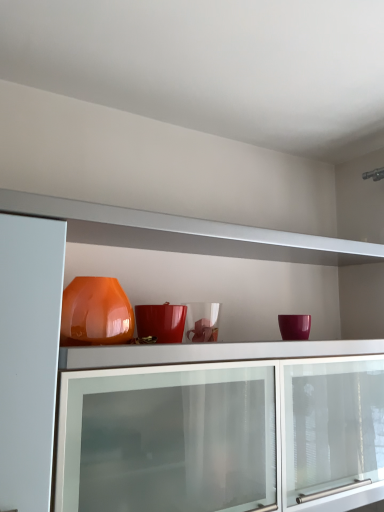
I want to click on matte orange vase at upper center, so click(225, 248).

What do you see at coordinates (225, 248) in the screenshot?
I see `matte orange vase at upper center` at bounding box center [225, 248].

You are a GUI agent. You are given a task and a screenshot of the screen. Output one action in this format:
    pyautogui.click(x=<x>, y=<y>)
    Task: Click on the matte orange vase at upper center
    This screenshot has height=512, width=384.
    Given the screenshot: What is the action you would take?
    pyautogui.click(x=225, y=248)